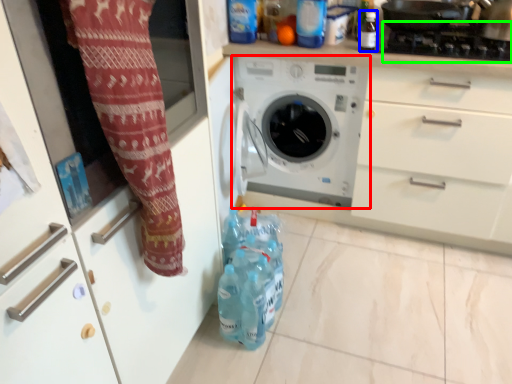
Question: Which object is positioned farthest from washing machine (highlighted by a red box)? Select from bottle (highlighted by a blue box) and gas stove (highlighted by a green box).

Choices:
 (A) bottle
 (B) gas stove

Answer: (B)